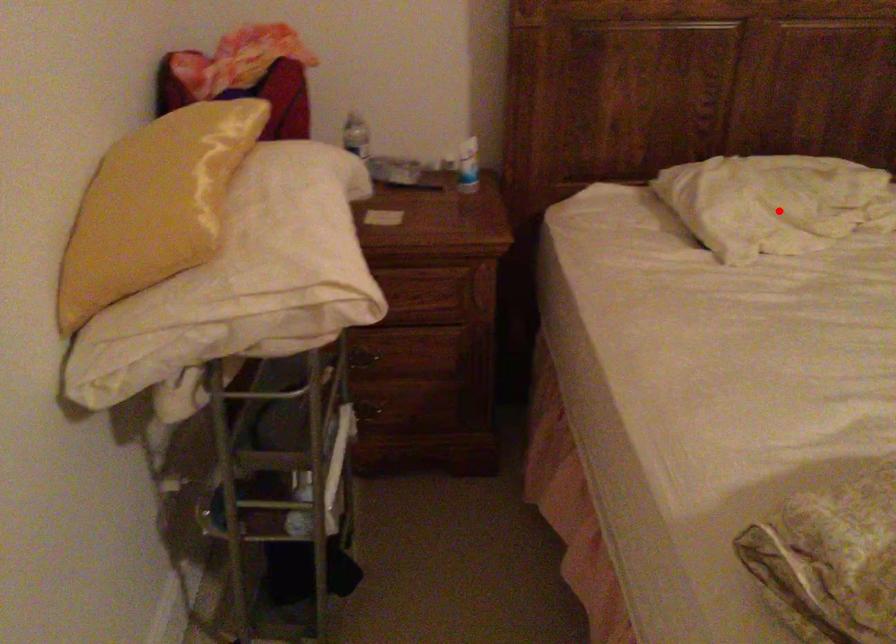
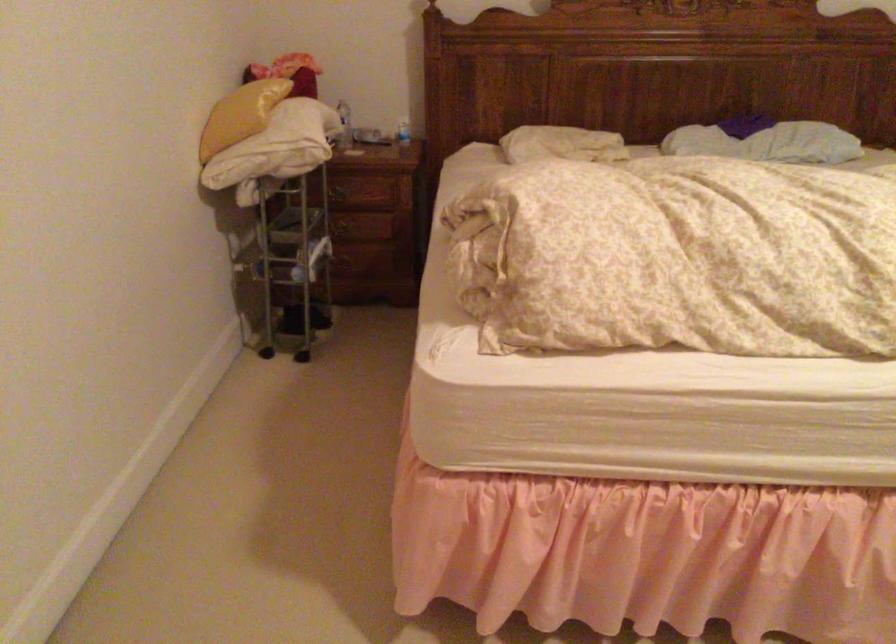
Question: I am providing you with two images of the same scene from different viewpoints. In image1, a red point is highlighted. Considering the same 3D point in image2, which of the following is correct?

Choices:
 (A) It is closer
 (B) It is farther

Answer: (B)